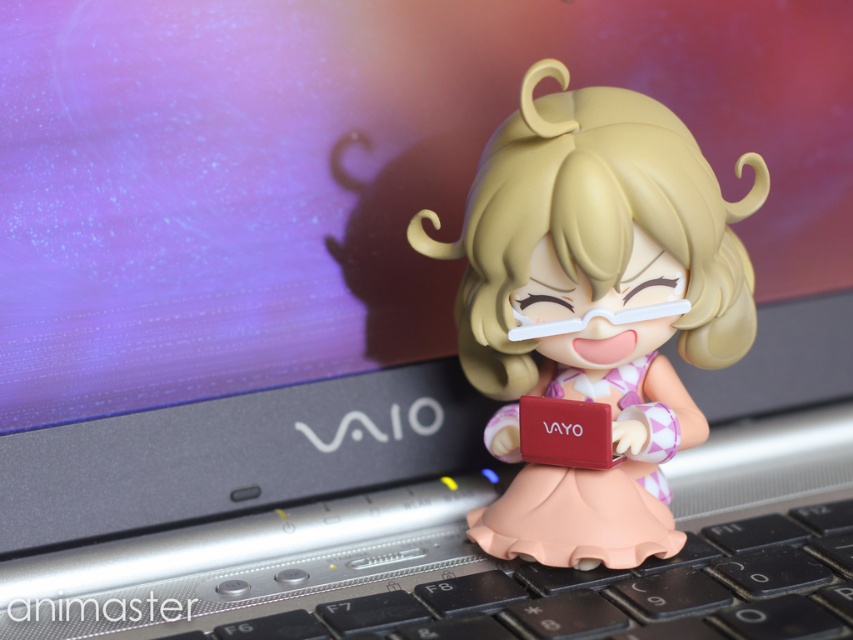
You are setting up a desk and want to place the matte plastic figurine at center and the black plastic keyboard at lower center. Considering their sizes, which object will take up more vertical space on your desk?

The matte plastic figurine at center is much taller than the black plastic keyboard at lower center, so it will take up more vertical space on the desk.

You are trying to type on the black plastic keyboard at lower center but notice the matte plastic figurine at center is blocking your way. Is the figurine in a position that would interfere with your typing?

The matte plastic figurine at center is located above the black plastic keyboard at lower center, so it is blocking the keyboard and would interfere with typing.

You are a delivery person who just arrived at a customer service desk. You need to place a matte plastic figurine at center on the desk. The desk has a maximum height of 36 inches. Can you safely place the figurine on the desk without it being too tall?

The distance between the matte plastic figurine at center and the viewer is 38.97 inches. Since the desk has a maximum height of 36 inches, placing the figurine would exceed the desk height limit. Please choose a lower desk or adjust the placement.